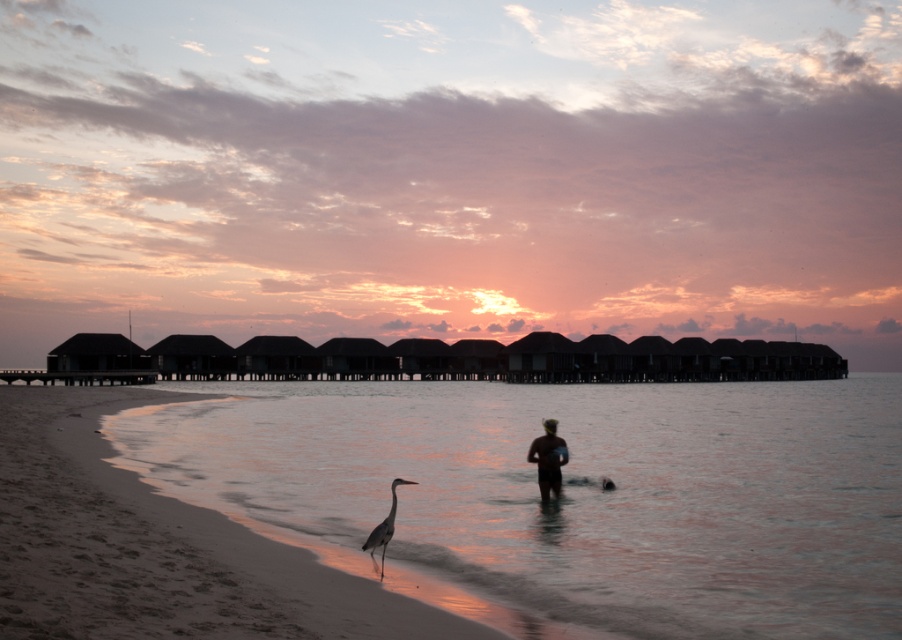
You are standing on the sandy beach at lower left and want to walk towards the water. Which direction should you move to reach the sandy water at lower left?

Since the sandy beach at lower left is behind the sandy water at lower left, you should move forward towards the sandy water at lower left to reach it.

You are standing on the sandy beach at lower left and want to reach the water. Which direction should you move to reach the sandy water at lower left?

The sandy water at lower left is located below the sandy beach at lower left, so you should move downward from the sandy beach at lower left to reach the sandy water at lower left.

You are standing on the sandy beach at lower left and want to approach the gray matte bird at lower center. Is the bird in front of or behind you?

The gray matte bird at lower center is behind you because the sandy beach at lower left is closer to the viewer than the bird.